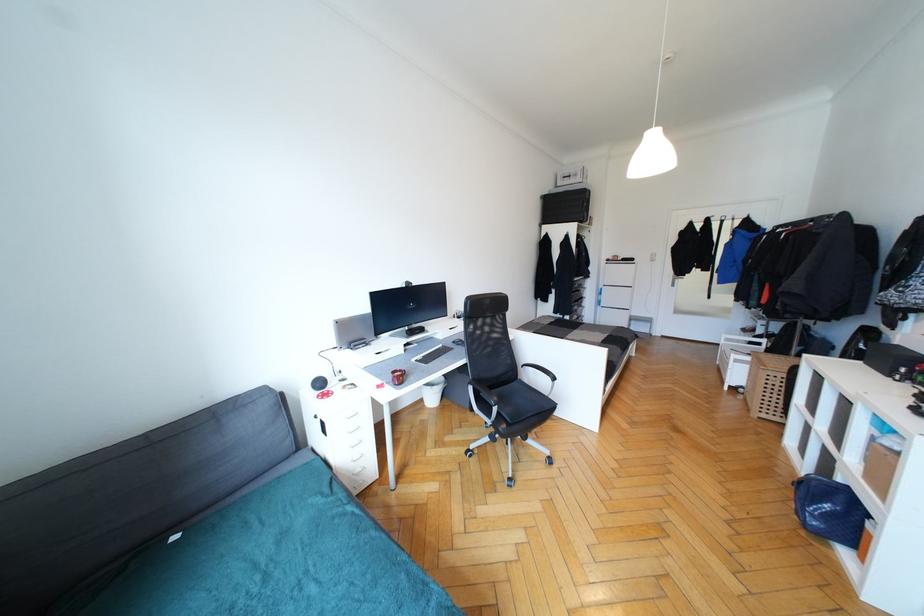
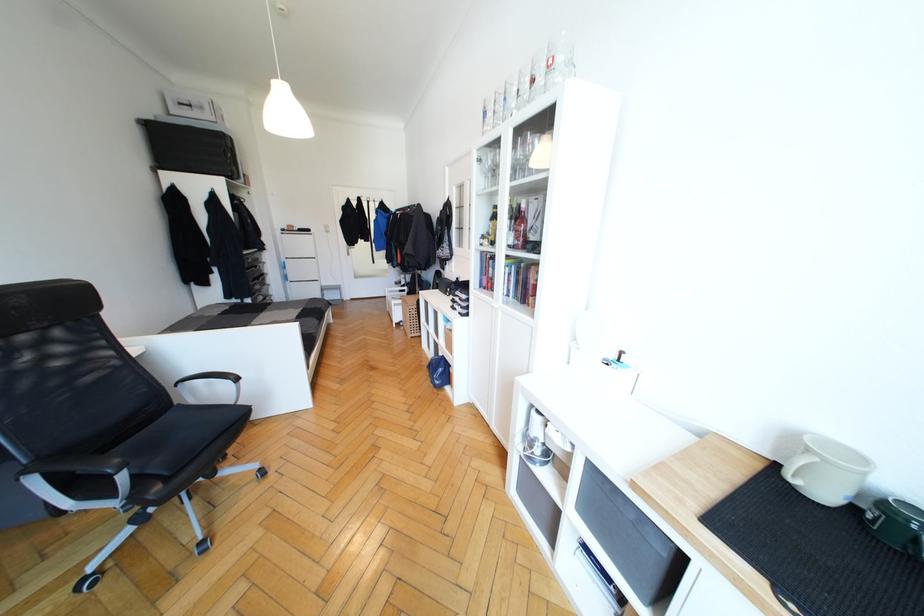
Locate, in the second image, the point that corresponds to pixel 556 379 in the first image.

(239, 379)